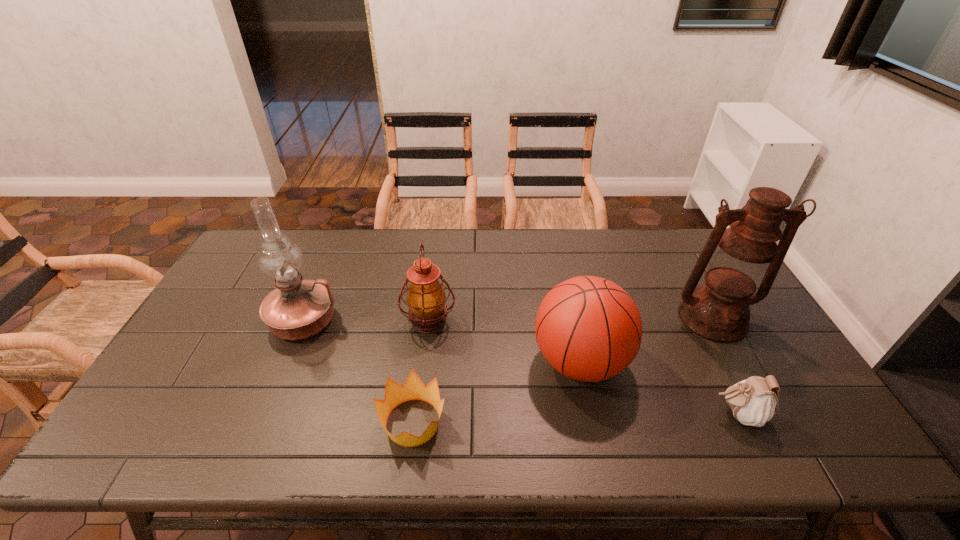
The width and height of the screenshot is (960, 540). What are the coordinates of `free space between the pouch and the shortest object` in the screenshot? It's located at (575, 418).

Where is `the fifth closest object to the rightmost oil lamp`? The image size is (960, 540). the fifth closest object to the rightmost oil lamp is located at coordinates (297, 309).

I want to click on object that stands as the closest to the shortest object, so click(426, 299).

This screenshot has height=540, width=960. I want to click on oil lamp identified as the third closest to the shortest object, so click(x=738, y=260).

Identify the location of oil lamp that is the closest to the shortest object. This screenshot has width=960, height=540. (426, 299).

I want to click on blank space that satisfies the following two spatial constraints: 1. on the front side of the rightmost oil lamp; 2. on the front-facing side of the second shortest object, so click(765, 415).